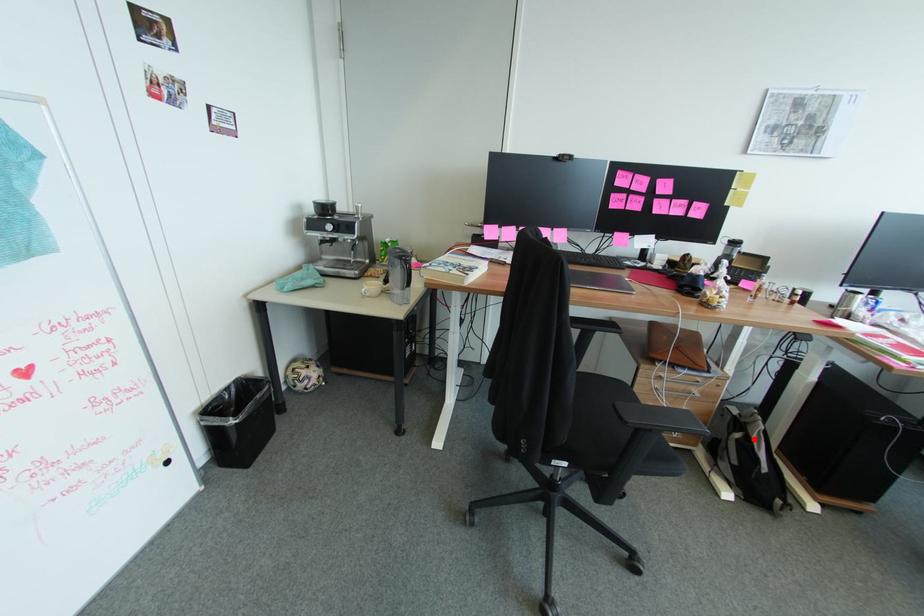
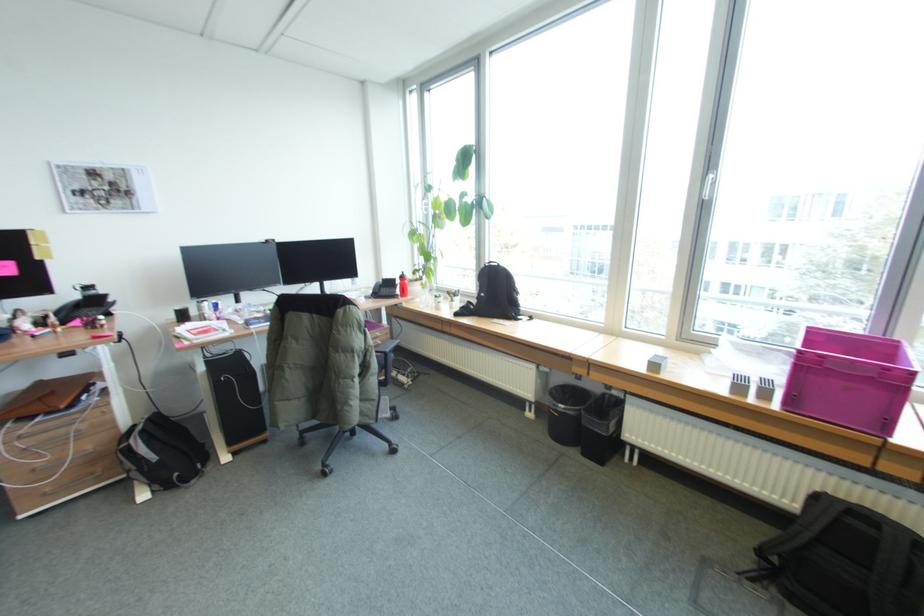
Find the pixel in the second image that matches the highlighted location in the first image.

(135, 444)